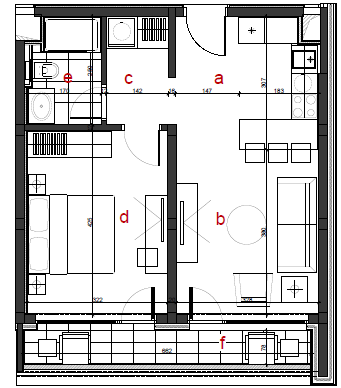
The width and height of the screenshot is (341, 388). Find the location of `floor plan`. floor plan is located at coordinates [186, 161].